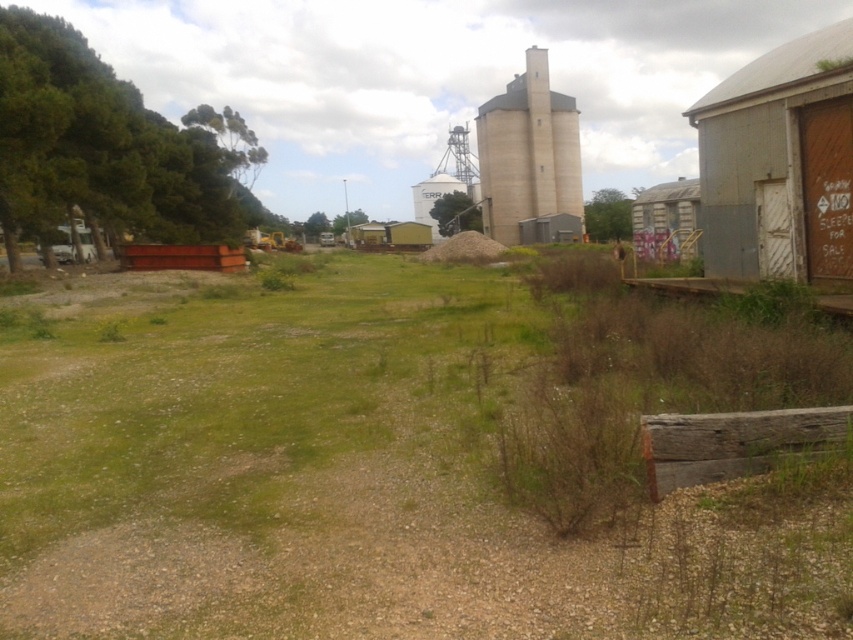
Question: Which of the following is the closest to the observer?

Choices:
 (A) (555, 160)
 (B) (39, 412)

Answer: (B)

Question: Which object appears farthest from the camera in this image?

Choices:
 (A) green grass at center
 (B) beige concrete silo at center

Answer: (B)

Question: Does green grass at center appear on the left side of beige concrete silo at center?

Choices:
 (A) yes
 (B) no

Answer: (A)

Question: Is green grass at center to the left of beige concrete silo at center from the viewer's perspective?

Choices:
 (A) no
 (B) yes

Answer: (B)

Question: Does green grass at center appear under beige concrete silo at center?

Choices:
 (A) no
 (B) yes

Answer: (B)